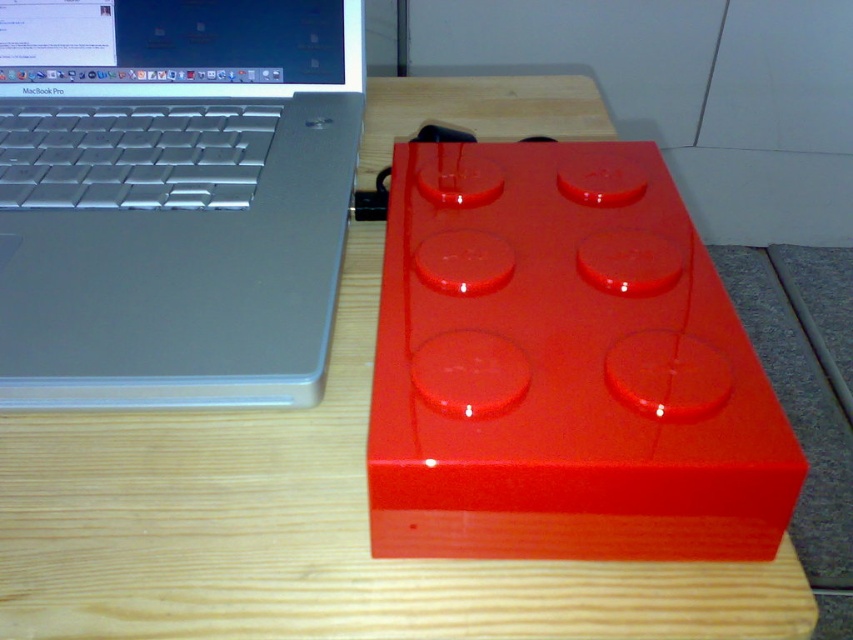
Question: Observing the image, what is the correct spatial positioning of glossy plastic block at center in reference to satin silver laptop at left?

Choices:
 (A) right
 (B) left

Answer: (A)

Question: Can you confirm if glossy plastic block at center is thinner than satin silver laptop at left?

Choices:
 (A) no
 (B) yes

Answer: (B)

Question: Is glossy plastic block at center to the left of satin silver laptop at left from the viewer's perspective?

Choices:
 (A) no
 (B) yes

Answer: (A)